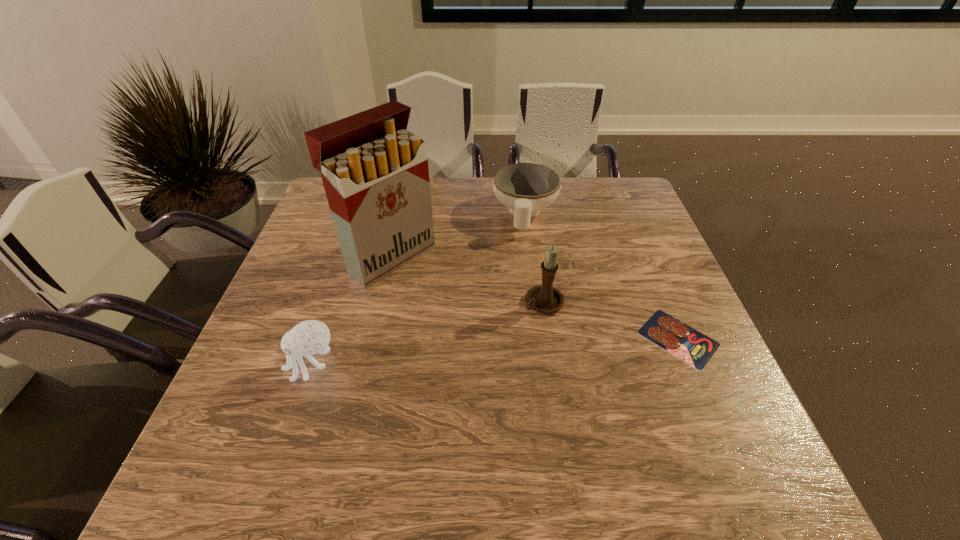
I want to click on unoccupied position between the rightmost object and the octopus, so click(495, 352).

The height and width of the screenshot is (540, 960). Find the location of `vacant area that lies between the second tallest object and the tallest object`. vacant area that lies between the second tallest object and the tallest object is located at coordinates (467, 280).

This screenshot has height=540, width=960. I want to click on free spot between the octopus and the tallest object, so click(x=351, y=311).

At what (x,y) coordinates should I click in order to perform the action: click on free spot between the candle holder and the octopus. Please return your answer as a coordinate pair (x, y). This screenshot has height=540, width=960. Looking at the image, I should click on (428, 334).

Where is `vacant space that is in between the cigarette case and the fourth tallest object`? This screenshot has width=960, height=540. vacant space that is in between the cigarette case and the fourth tallest object is located at coordinates (458, 235).

This screenshot has width=960, height=540. I want to click on object that ranks as the second closest to the cigarette case, so click(309, 337).

Find the location of `the fourth closest object to the tallest object`. the fourth closest object to the tallest object is located at coordinates (691, 346).

Identify the location of free space that satisfies the following two spatial constraints: 1. on the front side of the tallest object; 2. on the right side of the salami. (372, 338).

At what (x,y) coordinates should I click in order to perform the action: click on free space that satisfies the following two spatial constraints: 1. on the front side of the salami; 2. on the right side of the chinaware. Please return your answer as a coordinate pair (x, y). The height and width of the screenshot is (540, 960). Looking at the image, I should click on (541, 338).